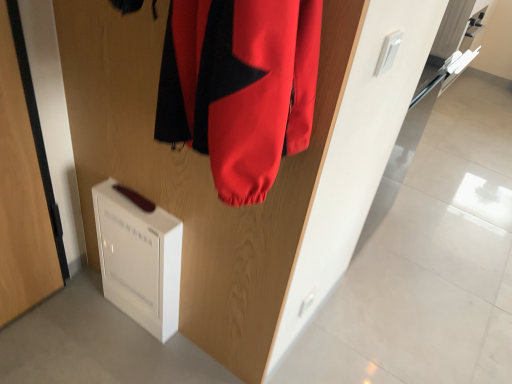
Find the location of a particular element. The height and width of the screenshot is (384, 512). vacant space in front of wooden door at center, placed as the 1th door when sorted from right to left is located at coordinates (150, 355).